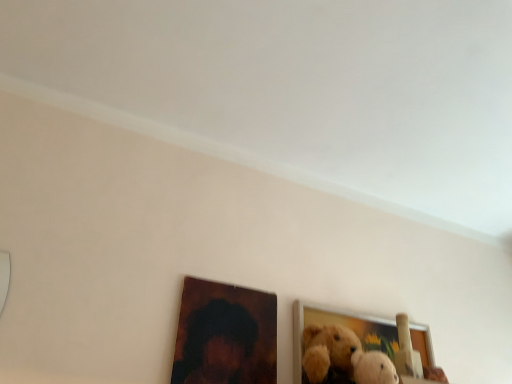
Question: Considering the positions of point (332, 311) and point (209, 375), is point (332, 311) closer or farther from the camera than point (209, 375)?

Choices:
 (A) farther
 (B) closer

Answer: (A)

Question: Visually, is wooden picture frame at lower right, positioned as the 2th picture frame in left-to-right order, positioned to the left or to the right of wooden picture frame at lower center, arranged as the first picture frame when viewed from the left?

Choices:
 (A) right
 (B) left

Answer: (A)

Question: Relative to wooden picture frame at lower center, the 2th picture frame when ordered from right to left, is wooden picture frame at lower right, which is the 1th picture frame from right to left, in front or behind?

Choices:
 (A) behind
 (B) front

Answer: (A)

Question: Is wooden picture frame at lower center, arranged as the first picture frame when viewed from the left, to the left or to the right of wooden picture frame at lower right, positioned as the 2th picture frame in left-to-right order, in the image?

Choices:
 (A) right
 (B) left

Answer: (B)

Question: Which is correct: wooden picture frame at lower center, arranged as the first picture frame when viewed from the left, is inside wooden picture frame at lower right, positioned as the 2th picture frame in left-to-right order, or outside of it?

Choices:
 (A) inside
 (B) outside

Answer: (B)

Question: In terms of width, does wooden picture frame at lower center, arranged as the first picture frame when viewed from the left, look wider or thinner when compared to wooden picture frame at lower right, which is the 1th picture frame from right to left?

Choices:
 (A) wide
 (B) thin

Answer: (B)

Question: From a real-world perspective, is wooden picture frame at lower center, the 2th picture frame when ordered from right to left, positioned above or below wooden picture frame at lower right, positioned as the 2th picture frame in left-to-right order?

Choices:
 (A) below
 (B) above

Answer: (B)